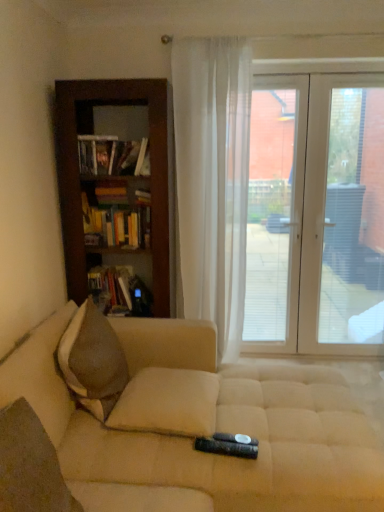
Question: Can you confirm if transparent plastic window screen at center, the second window screen from the right, is shorter than brown textured pillow at left?

Choices:
 (A) yes
 (B) no

Answer: (B)

Question: Is transparent plastic window screen at center, the second window screen from the right, positioned in front of brown textured pillow at left?

Choices:
 (A) no
 (B) yes

Answer: (A)

Question: Is brown textured pillow at left located within transparent plastic window screen at center, the second window screen from the right?

Choices:
 (A) yes
 (B) no

Answer: (B)

Question: From a real-world perspective, is transparent plastic window screen at center, which is the first window screen in left-to-right order, positioned over brown textured pillow at left based on gravity?

Choices:
 (A) no
 (B) yes

Answer: (B)

Question: From the image's perspective, is transparent plastic window screen at center, which is the first window screen in left-to-right order, above brown textured pillow at left?

Choices:
 (A) no
 (B) yes

Answer: (B)

Question: Would you say white sheer curtain at center is to the left or to the right of hardcover book at left, marked as the third book in a bottom-to-top arrangement, in the picture?

Choices:
 (A) left
 (B) right

Answer: (B)

Question: In terms of height, does white sheer curtain at center look taller or shorter compared to hardcover book at left, which ranks as the first book in top-to-bottom order?

Choices:
 (A) tall
 (B) short

Answer: (A)

Question: From the image's perspective, is white sheer curtain at center above or below hardcover book at left, which ranks as the first book in top-to-bottom order?

Choices:
 (A) above
 (B) below

Answer: (B)

Question: From a real-world perspective, is white sheer curtain at center positioned above or below hardcover book at left, which ranks as the first book in top-to-bottom order?

Choices:
 (A) above
 (B) below

Answer: (B)

Question: Relative to transparent glass door at right, which is the first window screen from right to left, is white sheer curtain at center in front or behind?

Choices:
 (A) behind
 (B) front

Answer: (B)

Question: From a real-world perspective, is white sheer curtain at center above or below transparent glass door at right, which is the first window screen from right to left?

Choices:
 (A) below
 (B) above

Answer: (B)

Question: Looking at their shapes, would you say white sheer curtain at center is wider or thinner than transparent glass door at right, which is the first window screen from right to left?

Choices:
 (A) thin
 (B) wide

Answer: (B)

Question: Visually, is white sheer curtain at center positioned to the left or to the right of transparent glass door at right, the second window screen viewed from the left?

Choices:
 (A) left
 (B) right

Answer: (A)

Question: Looking at the image, does brown textured pillow at lower left, which appears as the first pillow when viewed from the front, seem bigger or smaller compared to hardcover book at left, marked as the third book in a bottom-to-top arrangement?

Choices:
 (A) big
 (B) small

Answer: (A)

Question: From a real-world perspective, is brown textured pillow at lower left, which is counted as the 1th pillow, starting from the left, above or below hardcover book at left, which ranks as the first book in top-to-bottom order?

Choices:
 (A) below
 (B) above

Answer: (A)